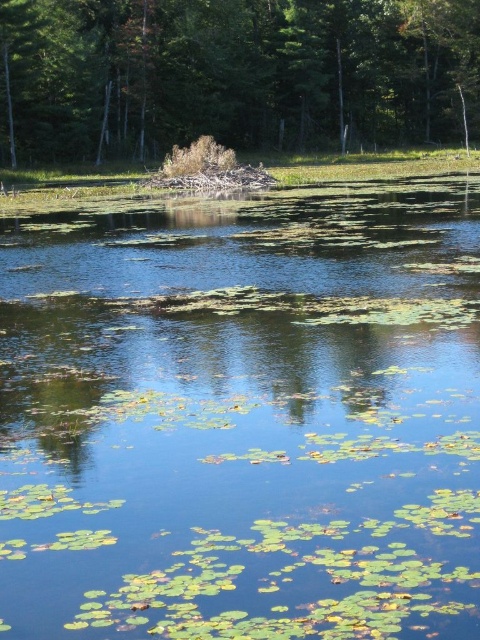
You are a photographer standing at the edge of the pond and want to capture both the point at coordinates point (312, 282) and point (264, 77) in your shot. Which point will appear larger in your photo?

Point (312, 282) is closer to the camera than point (264, 77), so it will appear larger in the photo.